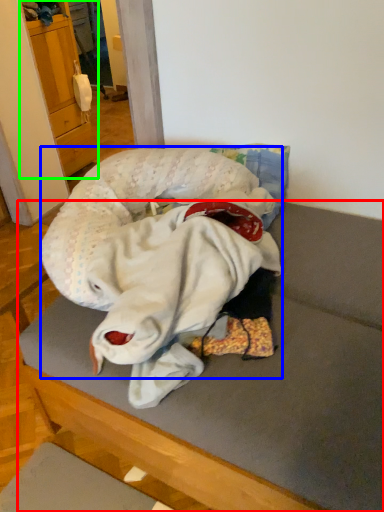
Question: Which object is positioned closest to furniture (highlighted by a red box)? Select from baby (highlighted by a blue box) and cabinetry (highlighted by a green box).

Choices:
 (A) baby
 (B) cabinetry

Answer: (A)